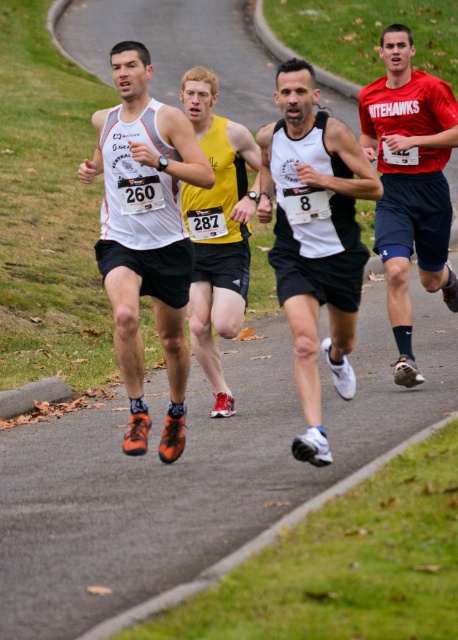
Is matte white tank top at center positioned before red matte jersey at center?

Yes, matte white tank top at center is closer to the viewer.

Where is `matte white tank top at center`? matte white tank top at center is located at coordinates (146, 234).

At what (x,y) coordinates should I click in order to perform the action: click on white matte tank top at center. Please return your answer as a coordinate pair (x, y). Image resolution: width=458 pixels, height=640 pixels. Looking at the image, I should click on (315, 237).

Does white matte tank top at center have a lesser height compared to red matte jersey at center?

Indeed, white matte tank top at center has a lesser height compared to red matte jersey at center.

Does point (298, 218) come closer to viewer compared to point (392, 132)?

Yes, point (298, 218) is closer to viewer.

Identify the location of white matte tank top at center. (315, 237).

Can you confirm if matte white tank top at center is positioned to the right of white matte tank top at center?

No, matte white tank top at center is not to the right of white matte tank top at center.

Between point (180, 436) and point (311, 317), which one is positioned behind?

The point (180, 436) is more distant.

I want to click on matte white tank top at center, so click(146, 234).